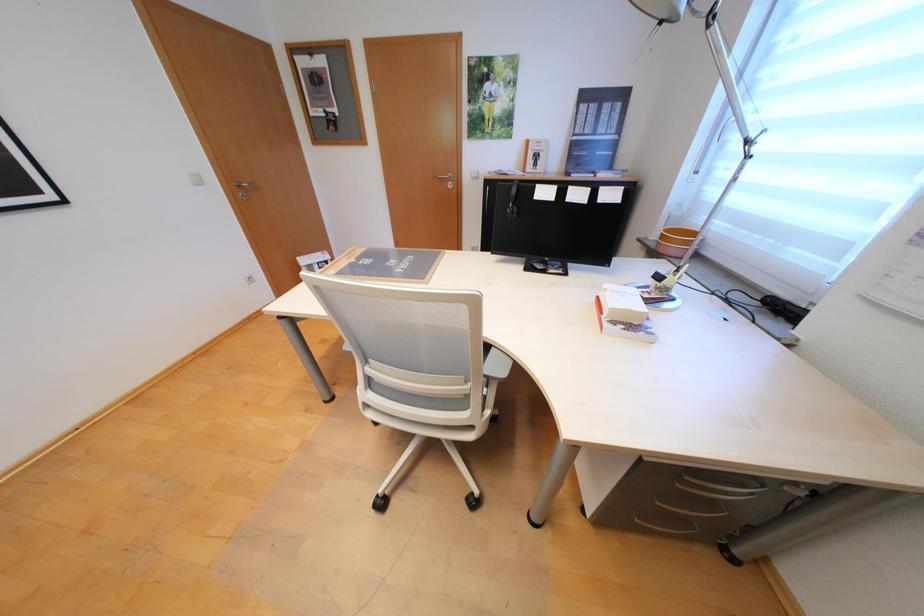
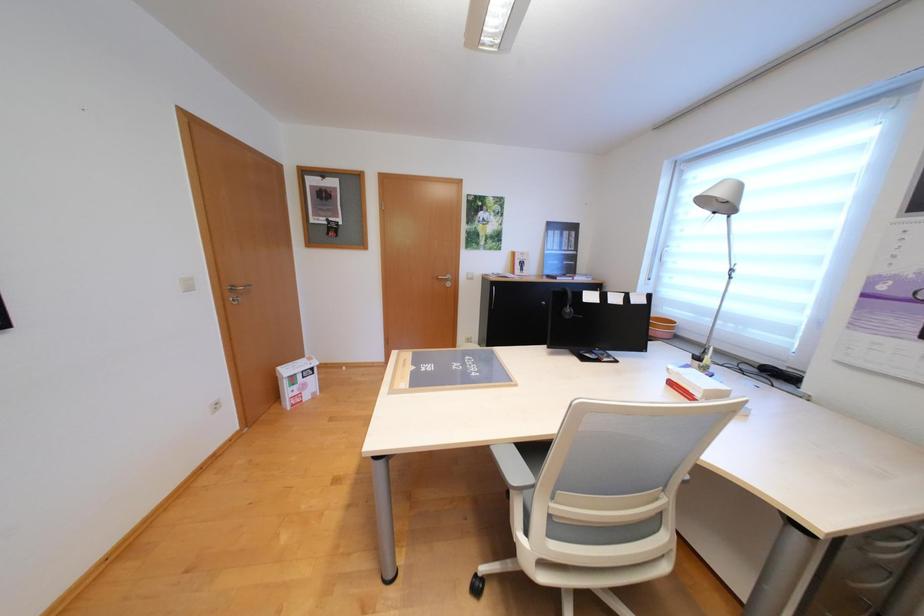
Based on the continuous images, in which direction is the camera rotating?

The camera rotated toward right-up.